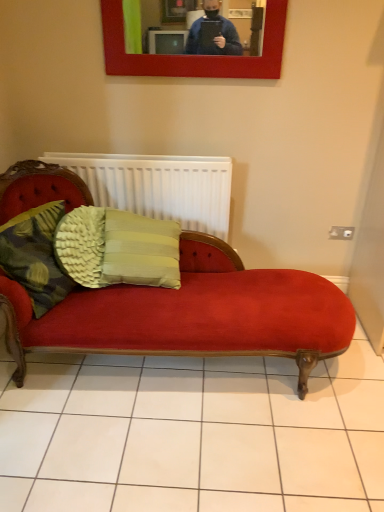
Question: Considering the relative positions of green textured cushion at center, the second pillow when ordered from left to right, and white matte radiator at center in the image provided, is green textured cushion at center, the second pillow when ordered from left to right, to the left or to the right of white matte radiator at center?

Choices:
 (A) left
 (B) right

Answer: (B)

Question: In the image, is green textured cushion at center, positioned as the 1th pillow in right-to-left order, positioned in front of or behind white matte radiator at center?

Choices:
 (A) front
 (B) behind

Answer: (A)

Question: Which object is the closest to the woven fabric cushion at left, positioned as the second pillow in right-to-left order?

Choices:
 (A) green textured cushion at center, positioned as the 1th pillow in right-to-left order
 (B) white matte radiator at center

Answer: (A)

Question: Which of these objects is positioned farthest from the green textured cushion at center, the second pillow when ordered from left to right?

Choices:
 (A) white matte radiator at center
 (B) woven fabric cushion at left, placed as the first pillow when sorted from left to right

Answer: (A)